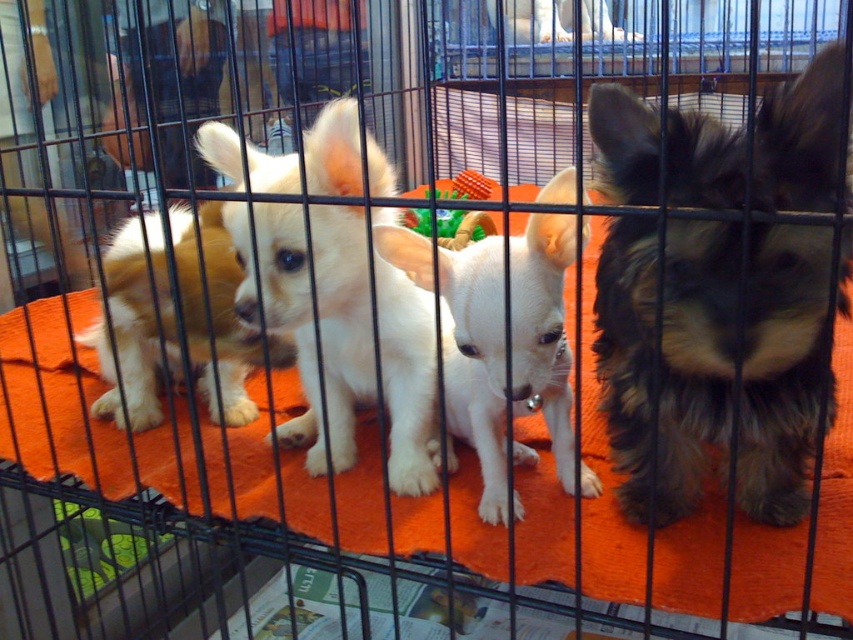
Question: From the image, what is the correct spatial relationship of dark brown fur at right in relation to white fur at upper center?

Choices:
 (A) below
 (B) above

Answer: (A)

Question: Is dark brown fur at right behind golden fur puppy at left?

Choices:
 (A) yes
 (B) no

Answer: (B)

Question: Which object is closer to the camera taking this photo?

Choices:
 (A) golden fur puppy at left
 (B) white fluffy dog at center
 (C) dark brown fur at right

Answer: (C)

Question: Does white fur at center have a lesser width compared to white fur at upper center?

Choices:
 (A) no
 (B) yes

Answer: (B)

Question: Estimate the real-world distances between objects in this image. Which object is closer to the white fluffy dog at center?

Choices:
 (A) golden fur puppy at left
 (B) white fur at upper center
 (C) dark brown fur at right
 (D) white fur at center

Answer: (D)

Question: Which is nearer to the white fluffy dog at center?

Choices:
 (A) golden fur puppy at left
 (B) dark brown fur at right

Answer: (A)